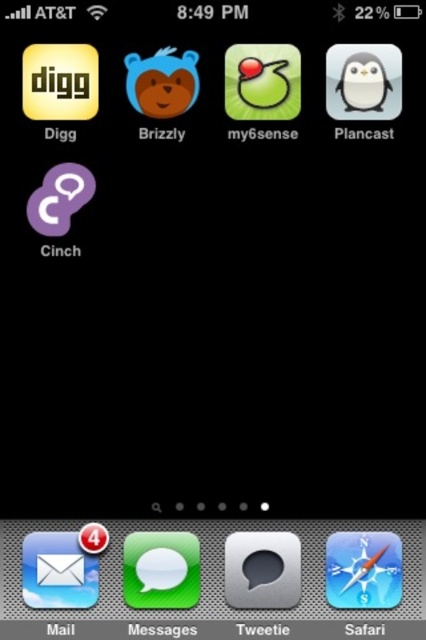
Question: Does green rubber duck at center appear under matte plastic bear at upper center?

Choices:
 (A) no
 (B) yes

Answer: (B)

Question: Which point is closer to the camera?

Choices:
 (A) (252, 547)
 (B) (261, 88)
 (C) (184, 67)

Answer: (A)

Question: Is green rubber duck at center positioned in front of matte plastic bear at upper center?

Choices:
 (A) yes
 (B) no

Answer: (B)

Question: Considering the relative positions of metallic gray speech bubble at center and matte plastic bear at upper center in the image provided, where is metallic gray speech bubble at center located with respect to matte plastic bear at upper center?

Choices:
 (A) below
 (B) above

Answer: (A)

Question: Based on their relative distances, which object is nearer to the green rubber duck at center?

Choices:
 (A) matte plastic bear at upper center
 (B) metallic gray speech bubble at center

Answer: (A)

Question: Which point is farther from the camera taking this photo?

Choices:
 (A) click(x=141, y=106)
 (B) click(x=253, y=51)
 (C) click(x=285, y=605)

Answer: (A)